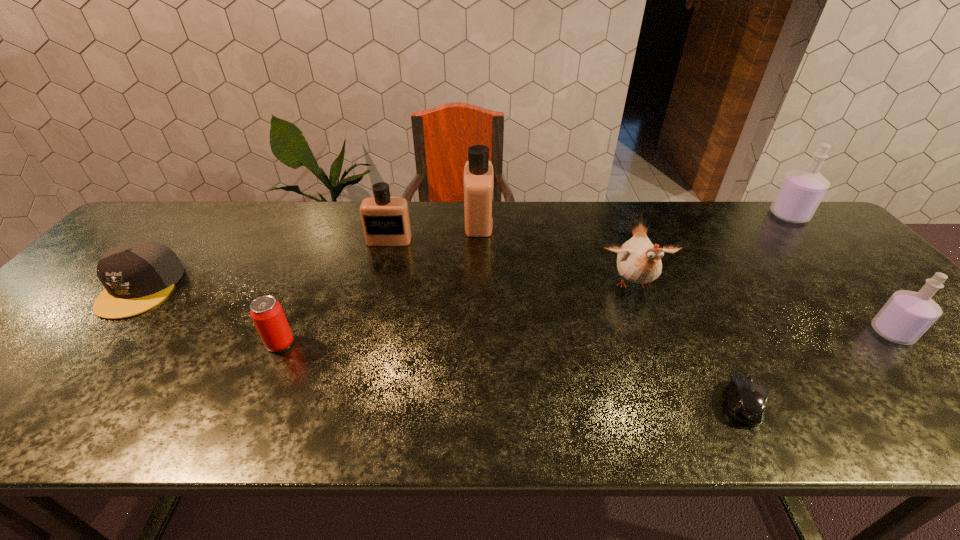
Locate an element on the screen. The image size is (960, 540). free space that satisfies the following two spatial constraints: 1. on the front label of the right beige perfume; 2. on the left side of the smaller purple perfume is located at coordinates (478, 333).

Find the location of a particular element. This screenshot has height=540, width=960. free region that satisfies the following two spatial constraints: 1. on the front-facing side of the beer can; 2. on the right side of the cap is located at coordinates (93, 343).

Locate an element on the screen. The width and height of the screenshot is (960, 540). vacant position in the image that satisfies the following two spatial constraints: 1. on the front-facing side of the leftmost object; 2. on the left side of the nearest object is located at coordinates (42, 403).

Find the location of a particular element. vacant position in the image that satisfies the following two spatial constraints: 1. on the front label of the leftmost perfume; 2. on the left side of the smaller purple perfume is located at coordinates (365, 333).